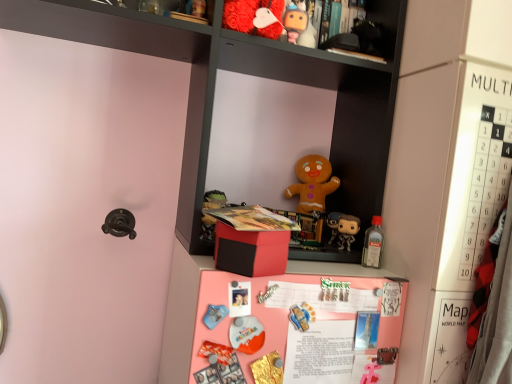
Question: Which direction should I rotate to look at matte plastic figurine at upper center, placed as the fourth toy when sorted from back to front, — up or down?

Choices:
 (A) up
 (B) down

Answer: (A)

Question: Can you see matte orange plush toy at center, which is counted as the 1th toy, starting from the front, touching matte gingerbread man at center, arranged as the first toy when viewed from the back?

Choices:
 (A) no
 (B) yes

Answer: (A)

Question: Considering the relative positions of matte orange plush toy at center, arranged as the 6th toy when viewed from the top, and matte gingerbread man at center, arranged as the first toy when viewed from the back, in the image provided, is matte orange plush toy at center, arranged as the 6th toy when viewed from the top, in front of matte gingerbread man at center, arranged as the first toy when viewed from the back,?

Choices:
 (A) yes
 (B) no

Answer: (A)

Question: Does matte orange plush toy at center, the 7th toy from the back, have a lesser width compared to matte gingerbread man at center, arranged as the first toy when viewed from the back?

Choices:
 (A) no
 (B) yes

Answer: (B)

Question: Would you say matte orange plush toy at center, arranged as the 6th toy when viewed from the top, is a long distance from matte gingerbread man at center, arranged as the first toy when viewed from the back?

Choices:
 (A) no
 (B) yes

Answer: (A)

Question: Is matte orange plush toy at center, which is the 2th toy in bottom-to-top order, turned away from matte gingerbread man at center, acting as the fifth toy starting from the bottom?

Choices:
 (A) yes
 (B) no

Answer: (B)

Question: Is matte orange plush toy at center, the 7th toy from the back, behind matte gingerbread man at center, which ranks as the 3th toy in top-to-bottom order?

Choices:
 (A) yes
 (B) no

Answer: (B)

Question: Are red matte box at center and pink matte board at center far apart?

Choices:
 (A) yes
 (B) no

Answer: (B)

Question: Is red matte box at center positioned before pink matte board at center?

Choices:
 (A) no
 (B) yes

Answer: (A)

Question: Does red matte box at center have a lesser width compared to pink matte board at center?

Choices:
 (A) yes
 (B) no

Answer: (A)

Question: Considering the relative positions of red matte box at center and pink matte board at center in the image provided, is red matte box at center to the right of pink matte board at center from the viewer's perspective?

Choices:
 (A) yes
 (B) no

Answer: (B)

Question: Can you confirm if red matte box at center is taller than pink matte board at center?

Choices:
 (A) no
 (B) yes

Answer: (A)

Question: From a real-world perspective, does red matte box at center stand above pink matte board at center?

Choices:
 (A) no
 (B) yes

Answer: (B)

Question: Is pink matte board at center behind matte gingerbread man at center, which ranks as the 3th toy in top-to-bottom order?

Choices:
 (A) yes
 (B) no

Answer: (B)